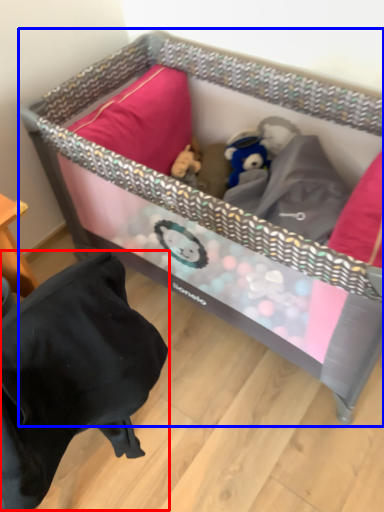
Question: Which object is closer to the camera taking this photo, bean bag chair (highlighted by a red box) or infant bed (highlighted by a blue box)?

Choices:
 (A) bean bag chair
 (B) infant bed

Answer: (A)